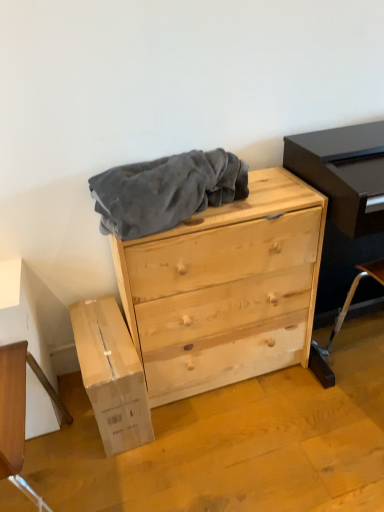
Question: From the image's perspective, relative to matte black entertainment center at right, is natural wood chest of drawers at center above or below?

Choices:
 (A) above
 (B) below

Answer: (B)

Question: Considering the positions of point (213, 262) and point (324, 194), is point (213, 262) closer or farther from the camera than point (324, 194)?

Choices:
 (A) closer
 (B) farther

Answer: (A)

Question: Which object is the closest to the matte black entertainment center at right?

Choices:
 (A) white cardboard box at lower left
 (B) velvety gray blanket at center
 (C) natural wood chest of drawers at center

Answer: (C)

Question: Which of these objects is positioned closest to the velvety gray blanket at center?

Choices:
 (A) white cardboard box at lower left
 (B) matte black entertainment center at right
 (C) natural wood chest of drawers at center

Answer: (C)